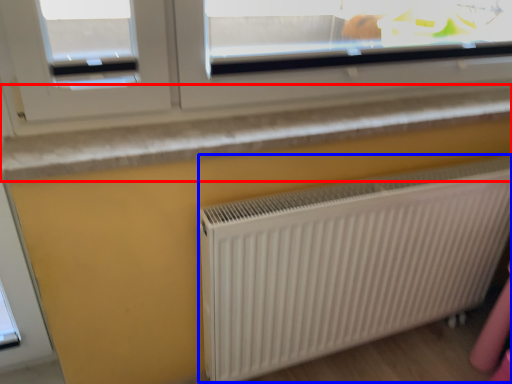
Question: Which object appears closest to the camera in this image, window sill (highlighted by a red box) or radiator (highlighted by a blue box)?

Choices:
 (A) window sill
 (B) radiator

Answer: (A)